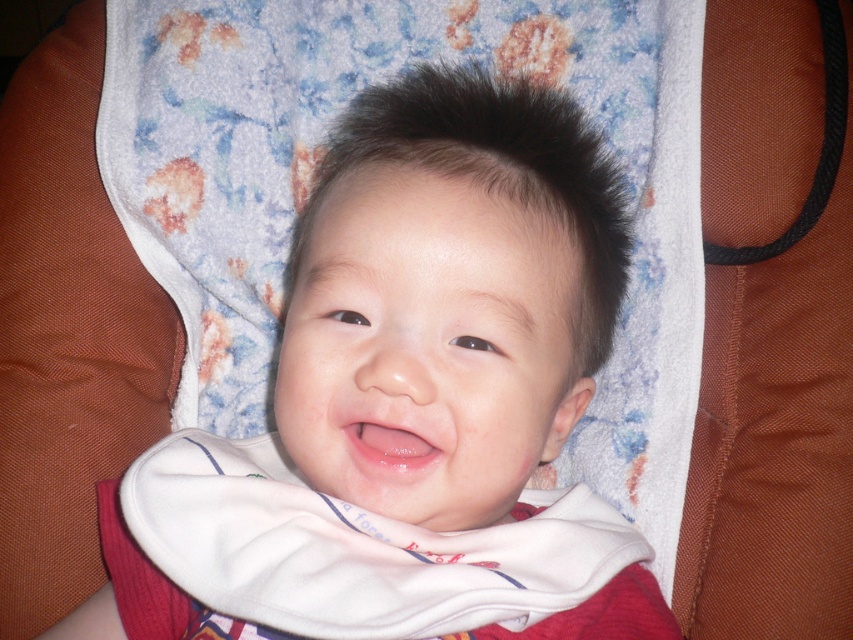
Does white soft bib at center come behind white cotton bib at center?

Yes.

Which is behind, point (344, 627) or point (413, 620)?

Positioned behind is point (413, 620).

What are the coordinates of `white soft bib at center` in the screenshot? It's located at (408, 401).

Where is `white soft bib at center`? white soft bib at center is located at coordinates (408, 401).

Who is lower down, white cotton bib at center or pink glossy lips at center?

white cotton bib at center is below.

Is white cotton bib at center smaller than pink glossy lips at center?

No, white cotton bib at center is not smaller than pink glossy lips at center.

Locate an element on the screen. The width and height of the screenshot is (853, 640). white cotton bib at center is located at coordinates (357, 557).

You are a GUI agent. You are given a task and a screenshot of the screen. Output one action in this format:
    pyautogui.click(x=<x>, y=<y>)
    Task: Click on the white cotton bib at center
    
    Given the screenshot: What is the action you would take?
    pyautogui.click(x=357, y=557)

Between point (328, 298) and point (361, 433), which one is positioned in front?

Point (328, 298) is more forward.

Consider the image. Between white soft bib at center and pink glossy lips at center, which one appears on the right side from the viewer's perspective?

pink glossy lips at center is more to the right.

The height and width of the screenshot is (640, 853). Find the location of `white soft bib at center`. white soft bib at center is located at coordinates (408, 401).